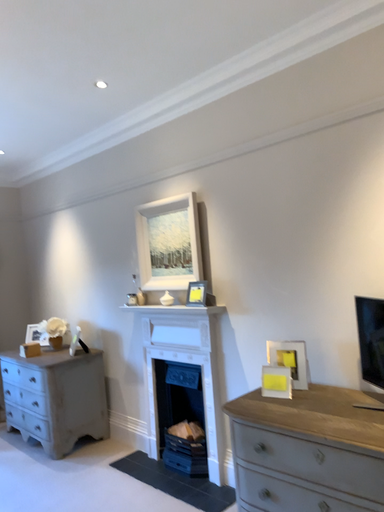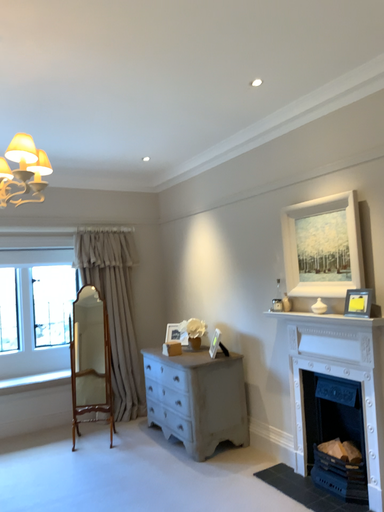
Question: Which way did the camera rotate in the video?

Choices:
 (A) rotated right
 (B) rotated left

Answer: (B)